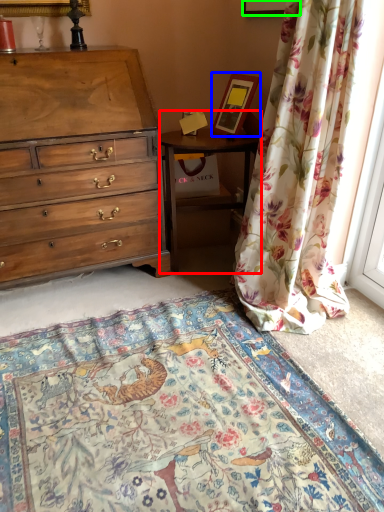
Question: Based on their relative distances, which object is nearer to nightstand (highlighted by a red box)? Choose from picture frame (highlighted by a blue box) and picture frame (highlighted by a green box).

Choices:
 (A) picture frame
 (B) picture frame

Answer: (A)